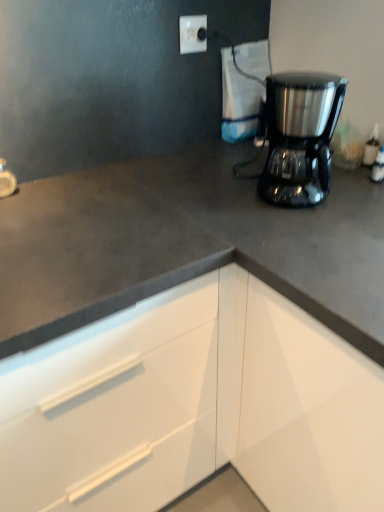
Image resolution: width=384 pixels, height=512 pixels. Find the location of `vacant space underneath satin black coffee maker at upper right (from a real-world perspective)`. vacant space underneath satin black coffee maker at upper right (from a real-world perspective) is located at coordinates (284, 202).